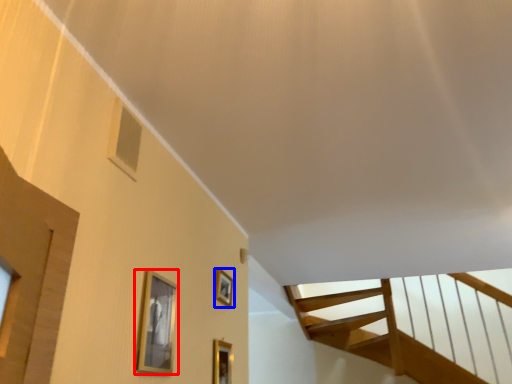
Question: Which of the following is the closest to the observer, picture frame (highlighted by a red box) or picture frame (highlighted by a blue box)?

Choices:
 (A) picture frame
 (B) picture frame

Answer: (A)